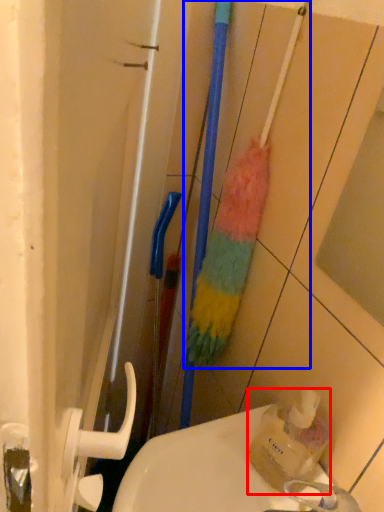
Question: Which point is further to the camera, bottle (highlighted by a red box) or brush (highlighted by a blue box)?

Choices:
 (A) bottle
 (B) brush

Answer: (B)